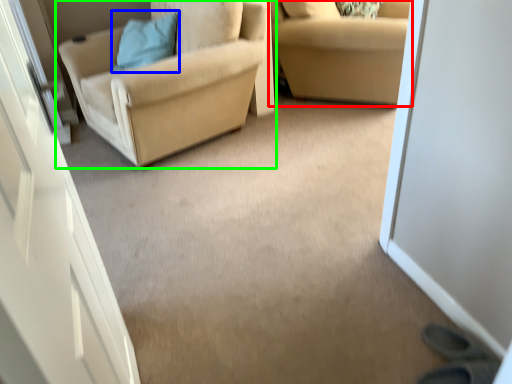
Question: Which is nearer to the studio couch (highlighted by a red box)? pillow (highlighted by a blue box) or chair (highlighted by a green box).

Choices:
 (A) pillow
 (B) chair

Answer: (B)